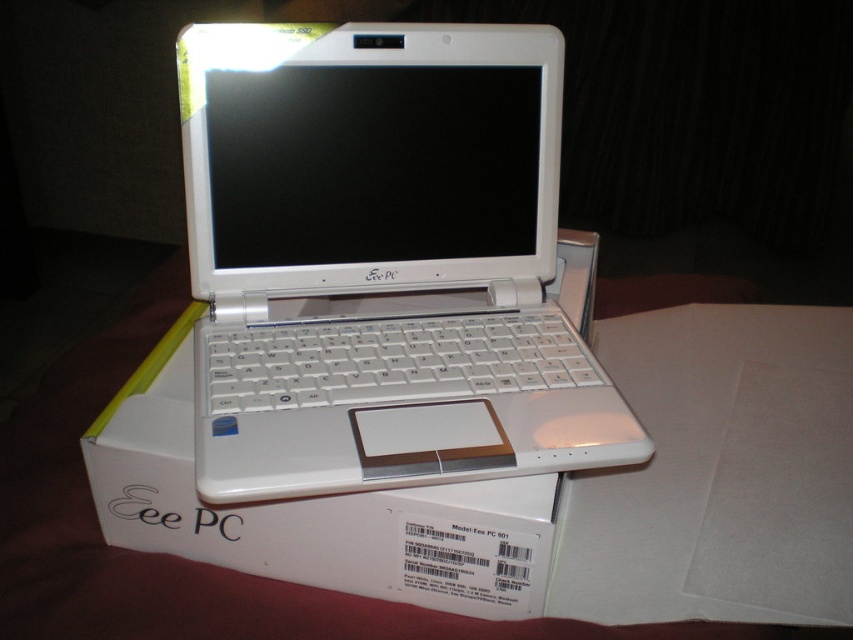
Question: Does white glossy laptop at center appear on the left side of white cardboard box at center?

Choices:
 (A) yes
 (B) no

Answer: (B)

Question: Can you confirm if white glossy laptop at center is positioned to the left of white cardboard box at center?

Choices:
 (A) no
 (B) yes

Answer: (A)

Question: Does white glossy laptop at center appear under white cardboard box at center?

Choices:
 (A) no
 (B) yes

Answer: (A)